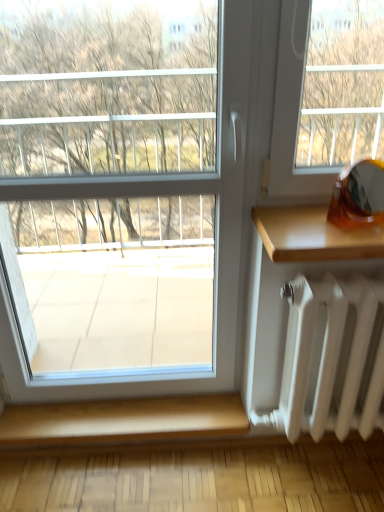
Image resolution: width=384 pixels, height=512 pixels. What do you see at coordinates (123, 420) in the screenshot? I see `smooth wood window sill at lower center` at bounding box center [123, 420].

The width and height of the screenshot is (384, 512). Find the location of `smooth wood window sill at lower center`. smooth wood window sill at lower center is located at coordinates (123, 420).

The width and height of the screenshot is (384, 512). What are the coordinates of `smooth wood window sill at lower center` in the screenshot? It's located at (123, 420).